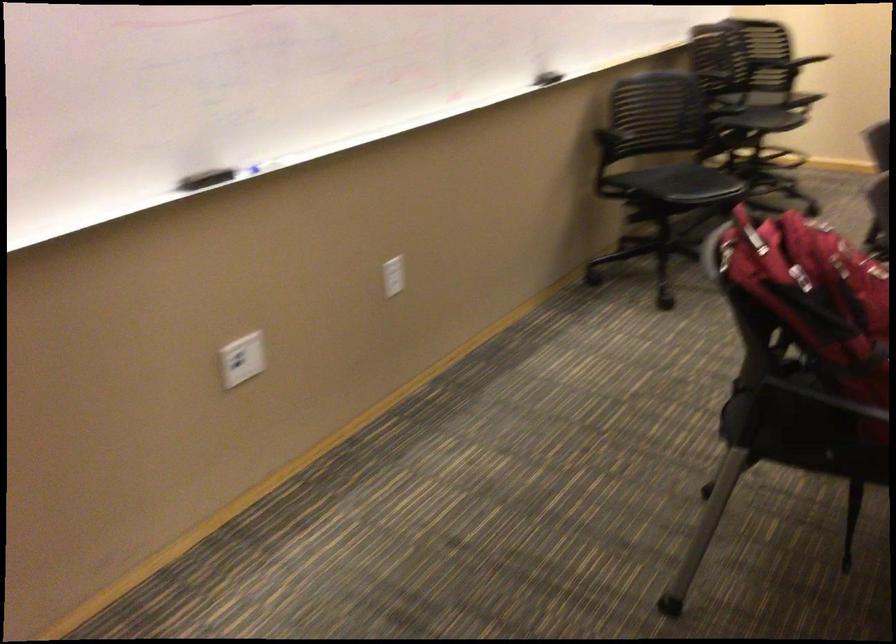
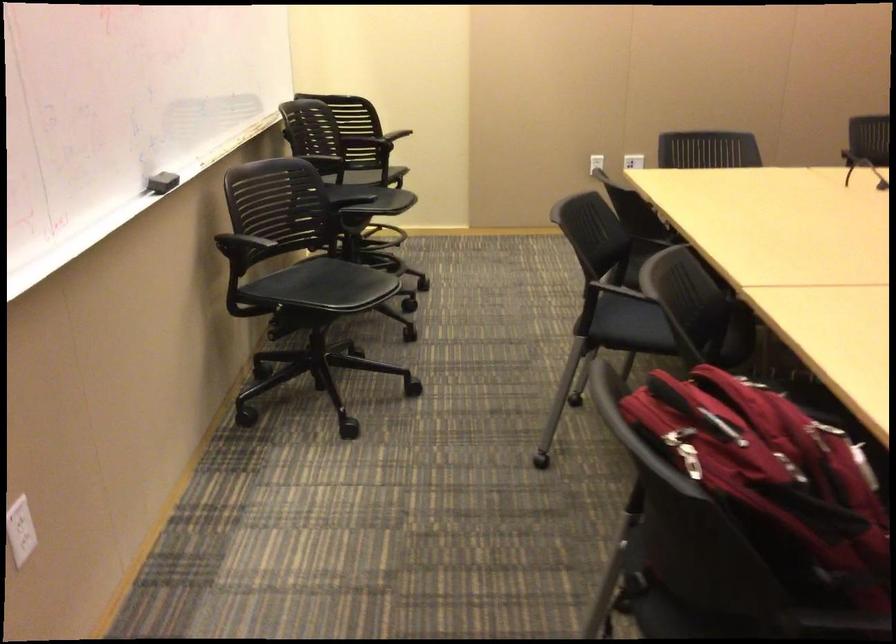
Question: Based on the continuous images, in which direction is the camera rotating? Reply with the corresponding letter.

Choices:
 (A) Left
 (B) Right
 (C) Up
 (D) Down

Answer: (B)